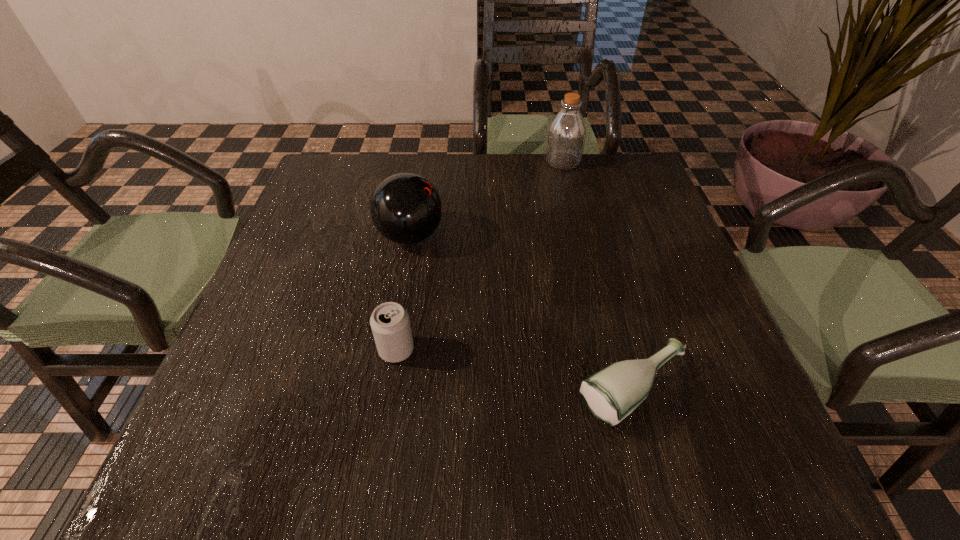
Image resolution: width=960 pixels, height=540 pixels. I want to click on vacant region located on the left of the shortest object, so click(384, 391).

At what (x,y) coordinates should I click in order to perform the action: click on object that is positioned at the far edge. Please return your answer as a coordinate pair (x, y). The height and width of the screenshot is (540, 960). Looking at the image, I should click on (566, 136).

This screenshot has height=540, width=960. Find the location of `object that is at the near edge`. object that is at the near edge is located at coordinates (611, 394).

The height and width of the screenshot is (540, 960). What are the coordinates of `object situated at the right edge` in the screenshot? It's located at (611, 394).

I want to click on object situated at the near right corner, so click(x=611, y=394).

Where is `vacant space at the far edge of the desktop`? The height and width of the screenshot is (540, 960). vacant space at the far edge of the desktop is located at coordinates coord(516,165).

Identify the location of vacant space at the left edge of the desktop. The width and height of the screenshot is (960, 540). (353, 220).

Where is `free space at the right edge of the desktop`? This screenshot has height=540, width=960. free space at the right edge of the desktop is located at coordinates (616, 254).

This screenshot has height=540, width=960. Identify the location of vacant space at the far left corner of the desktop. (324, 174).

The height and width of the screenshot is (540, 960). Find the location of `free space at the near right corner`. free space at the near right corner is located at coordinates (746, 461).